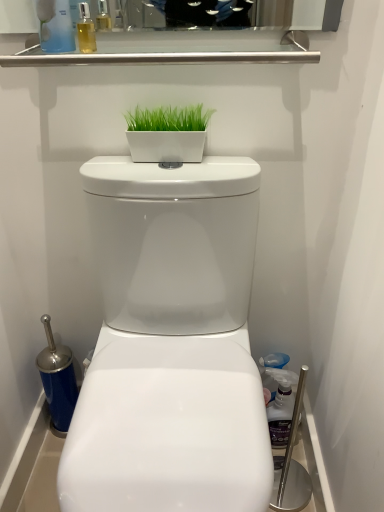
At what (x,y) coordinates should I click in order to perform the action: click on empty space that is to the right of green matte planter at center. Please return your answer as a coordinate pair (x, y). Looking at the image, I should click on (231, 163).